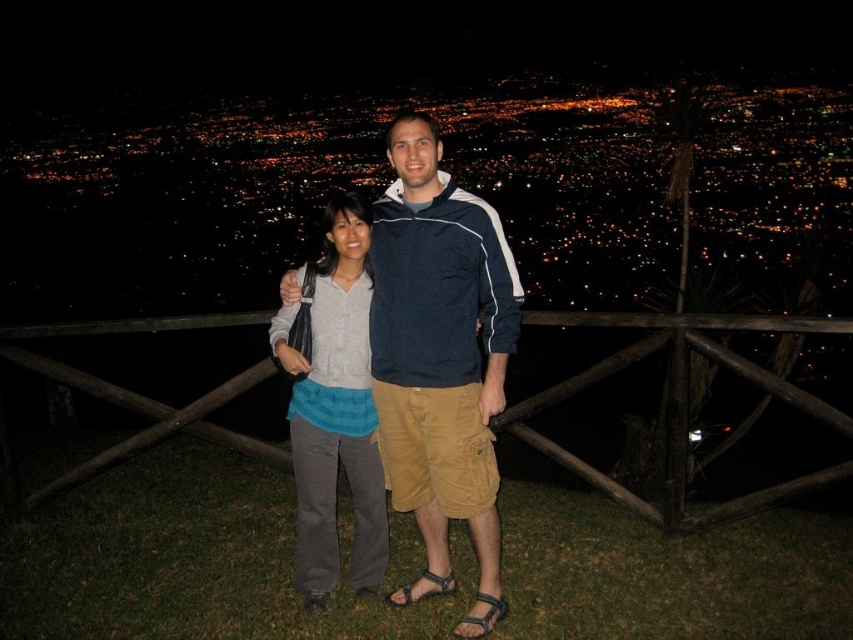
Does black leather sandal at lower center appear over brown leather sandal at lower center?

Incorrect, black leather sandal at lower center is not positioned above brown leather sandal at lower center.

Is black leather sandal at lower center positioned before brown leather sandal at lower center?

That is True.

Is point (486, 628) less distant than point (387, 600)?

That is True.

This screenshot has height=640, width=853. What are the coordinates of `black leather sandal at lower center` in the screenshot? It's located at (480, 616).

Can you confirm if matte gray pants at center is positioned above black leather sandal at lower center?

Correct, matte gray pants at center is located above black leather sandal at lower center.

Between matte gray pants at center and black leather sandal at lower center, which one is positioned lower?

black leather sandal at lower center is below.

Is point (321, 312) farther from camera compared to point (479, 616)?

Yes, it is.

Locate an element on the screen. This screenshot has width=853, height=640. matte gray pants at center is located at coordinates (335, 412).

Is blue cotton shirt at center below matte gray pants at center?

No, blue cotton shirt at center is not below matte gray pants at center.

Image resolution: width=853 pixels, height=640 pixels. What are the coordinates of `blue cotton shirt at center` in the screenshot? It's located at (440, 346).